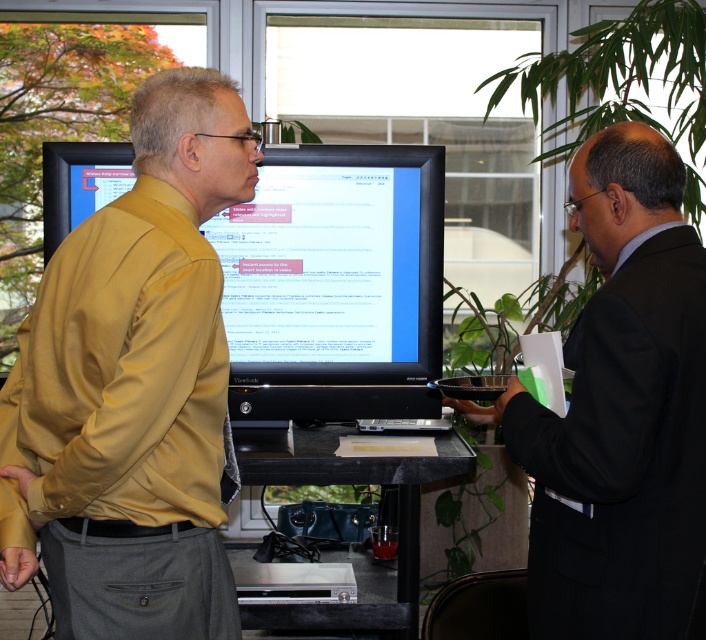
Question: Estimate the real-world distances between objects in this image. Which object is farther from the black suit at right?

Choices:
 (A) matte black monitor at center
 (B) matte yellow shirt at center

Answer: (A)

Question: Which object is farther from the camera taking this photo?

Choices:
 (A) matte black monitor at center
 (B) black suit at right

Answer: (A)

Question: Is matte yellow shirt at center smaller than matte black monitor at center?

Choices:
 (A) yes
 (B) no

Answer: (B)

Question: Among these points, which one is nearest to the camera?

Choices:
 (A) (64, 224)
 (B) (113, 518)
 (C) (681, 413)

Answer: (B)

Question: Is matte yellow shirt at center smaller than matte black monitor at center?

Choices:
 (A) no
 (B) yes

Answer: (A)

Question: Is black suit at right smaller than matte black monitor at center?

Choices:
 (A) yes
 (B) no

Answer: (B)